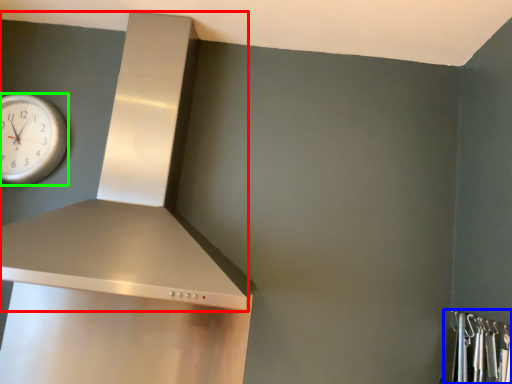
Question: Which is farther away from vent (highlighted by a red box)? closet (highlighted by a blue box) or wall clock (highlighted by a green box)?

Choices:
 (A) closet
 (B) wall clock

Answer: (A)